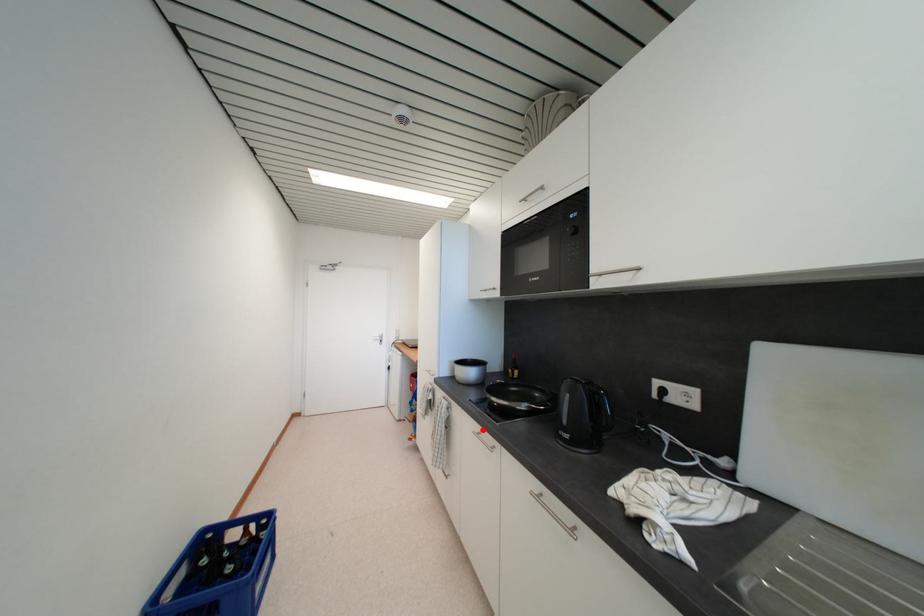
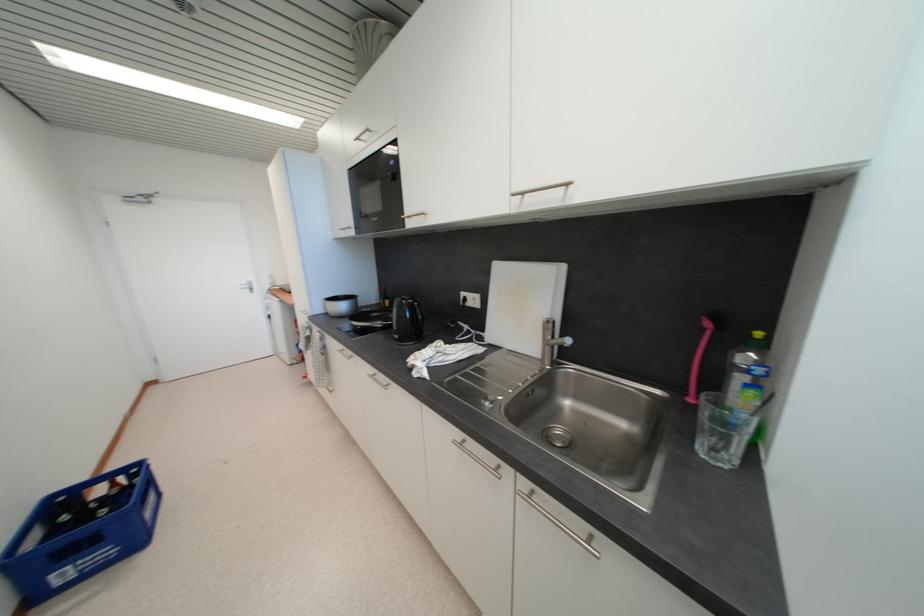
Question: I am providing you with two images of the same scene from different viewpoints. In image1, a red point is highlighted. Considering the same 3D point in image2, which of the following is correct?

Choices:
 (A) It is closer
 (B) It is farther

Answer: (B)